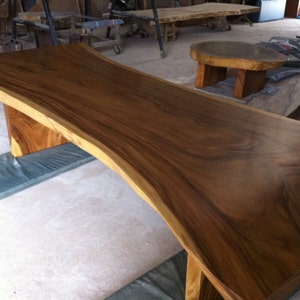
Identify the location of table legs. The image size is (300, 300). (206, 76), (244, 86), (26, 134), (193, 277).